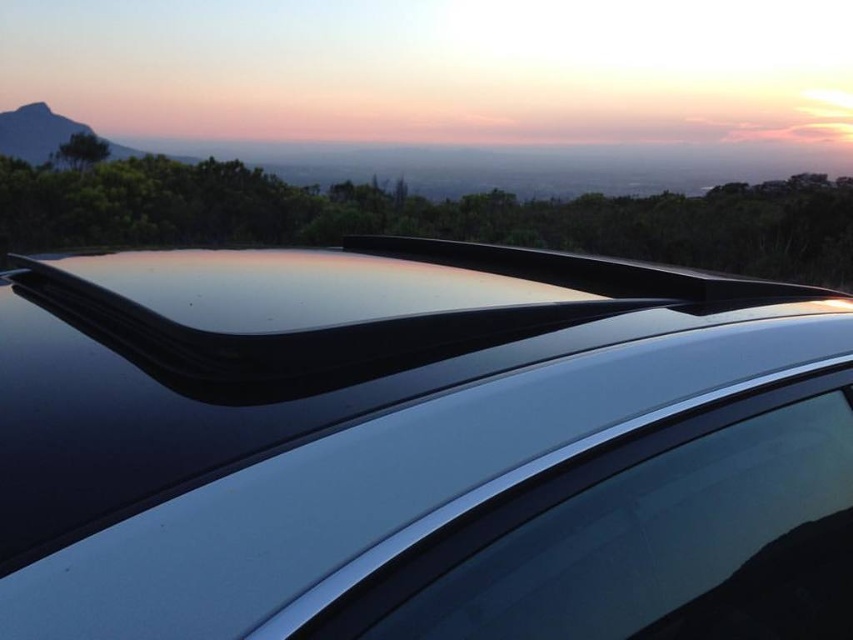
You are sitting in the car and looking out through the sunroof. You notice two points in the scene labeled as point 1 at coordinates point (x=425, y=561) and point 2 at coordinates point (x=9, y=124). Which point is closer to you?

Point (x=425, y=561) is closer to the viewer than point (x=9, y=124).

You are a delivery person trying to secure a large package on the car roof. The package is 1.2 meters wide. You need to know if the glossy black roof rack at upper center can accommodate the package without overlapping the satin silver glass at center. Can it fit?

The glossy black roof rack at upper center might be wider than the satin silver glass at center, so there is a possibility that the package could fit without overlapping. However, since the exact width difference isn not specified, it is recommended to measure both to ensure proper placement.